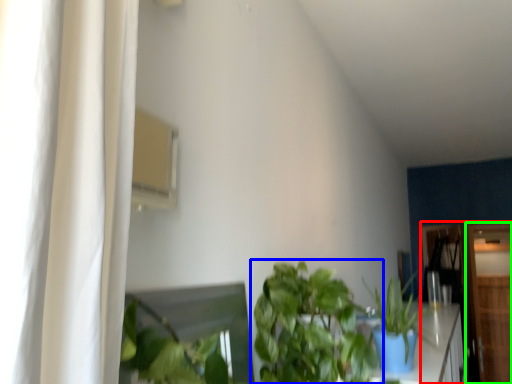
Question: Which is farther away from dresser (highlighted by a red box)? houseplant (highlighted by a blue box) or dresser (highlighted by a green box)?

Choices:
 (A) houseplant
 (B) dresser

Answer: (A)